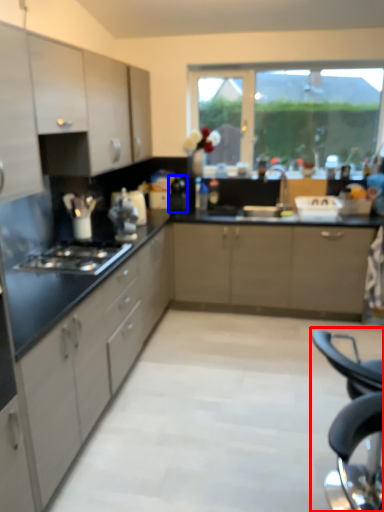
Question: Which of the following is the closest to the observer, folding chair (highlighted by a red box) or appliance (highlighted by a blue box)?

Choices:
 (A) folding chair
 (B) appliance

Answer: (A)